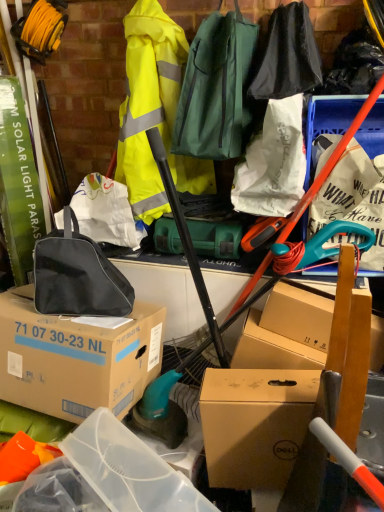
Question: From the image's perspective, is white paper bag at upper center, which ranks as the second clothing in left-to-right order, above or below white paper bag at upper right?

Choices:
 (A) below
 (B) above

Answer: (B)

Question: Is point (273, 173) positioned closer to the camera than point (364, 157)?

Choices:
 (A) farther
 (B) closer

Answer: (A)

Question: Which object is positioned farthest from the brown cardboard box at center, which ranks as the first box in left-to-right order?

Choices:
 (A) white paper bag at upper right
 (B) white paper bag at upper center, which ranks as the second clothing in left-to-right order
 (C) black fabric bag at center-left, which is counted as the 1th luggage and bags, starting from the bottom
 (D) brown cardboard box at center, the first box when ordered from right to left
 (E) black fabric bag at upper center, placed as the 3th clothing when sorted from left to right

Answer: (E)

Question: Considering the real-world distances, which object is closest to the black fabric bag at center-left, which ranks as the second luggage and bags in right-to-left order?

Choices:
 (A) white paper bag at upper center, which is the 2th clothing from right to left
 (B) high-visibility yellow jacket at upper center, marked as the first clothing in a left-to-right arrangement
 (C) brown cardboard box at center, the first box when ordered from right to left
 (D) brown cardboard box at center, arranged as the second box when viewed from the right
 (E) white paper bag at upper right

Answer: (D)